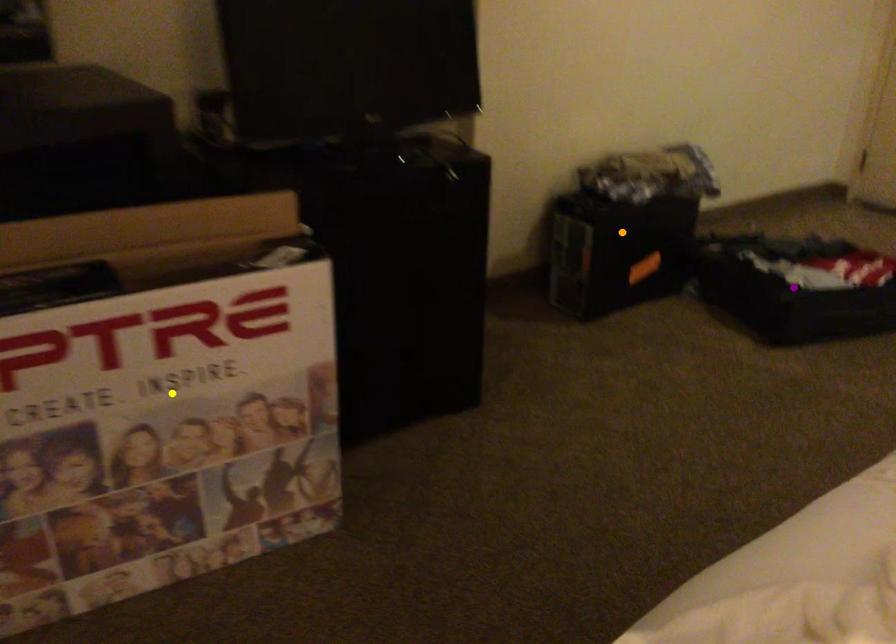
Order these from nearest to farthest:
orange point | purple point | yellow point

orange point
purple point
yellow point